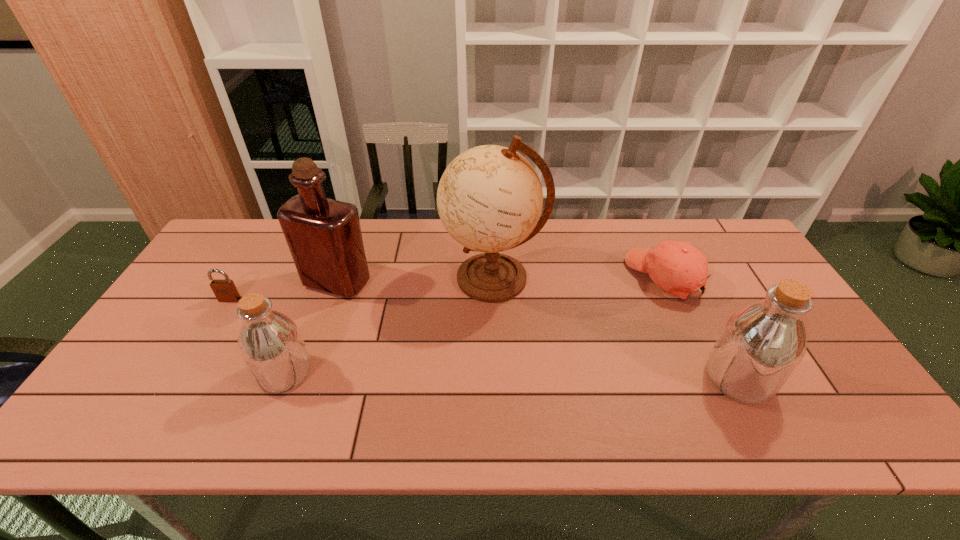
This screenshot has height=540, width=960. Identify the location of the shorter bottle. (270, 343).

The height and width of the screenshot is (540, 960). In order to click on the left bottle in this screenshot , I will do `click(270, 343)`.

This screenshot has height=540, width=960. I want to click on the right bottle, so click(x=761, y=345).

In order to click on the taller bottle in this screenshot , I will do `click(761, 345)`.

Find the location of a particular element. globe is located at coordinates (489, 199).

The image size is (960, 540). I want to click on liquor, so click(x=324, y=236).

This screenshot has width=960, height=540. Identify the location of padlock. (225, 290).

Locate an element on the screen. Image resolution: width=960 pixels, height=540 pixels. the shortest object is located at coordinates (225, 290).

Locate an element on the screen. The image size is (960, 540). the fifth tallest object is located at coordinates (679, 268).

The height and width of the screenshot is (540, 960). Identify the location of vacant region located on the back of the left bottle. (324, 272).